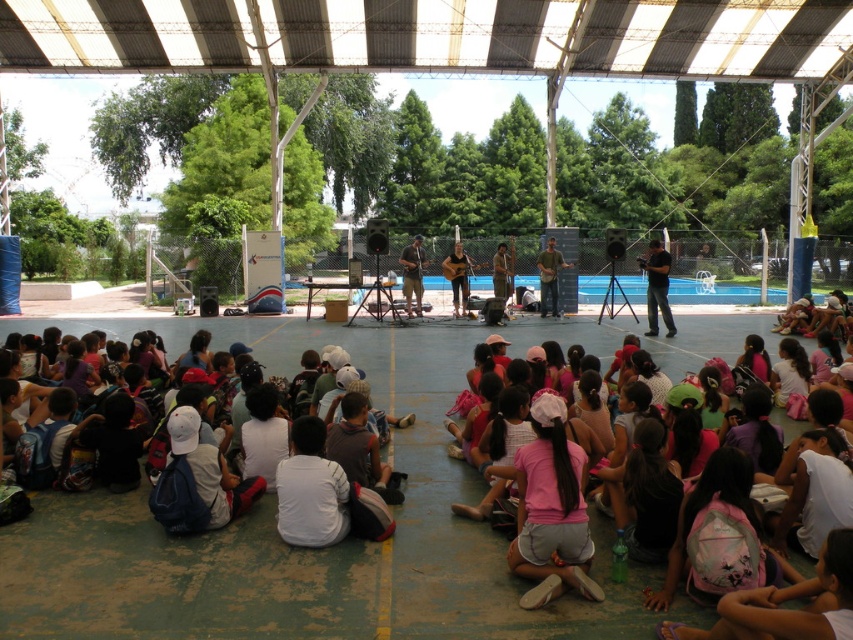
Question: Does pink fabric backpacks at lower center appear on the right side of black matte camera at center?

Choices:
 (A) yes
 (B) no

Answer: (B)

Question: Can you confirm if pink fabric backpacks at lower center is positioned to the right of black matte camera at center?

Choices:
 (A) yes
 (B) no

Answer: (B)

Question: Is pink fabric backpacks at lower center smaller than black matte camera at center?

Choices:
 (A) yes
 (B) no

Answer: (B)

Question: Which object is farther from the camera taking this photo?

Choices:
 (A) pink fabric backpacks at lower center
 (B) black matte camera at center

Answer: (B)

Question: Which of the following is the farthest from the observer?

Choices:
 (A) (668, 524)
 (B) (647, 310)

Answer: (B)

Question: Which point is farther to the camera?

Choices:
 (A) black matte camera at center
 (B) pink fabric backpacks at lower center

Answer: (A)